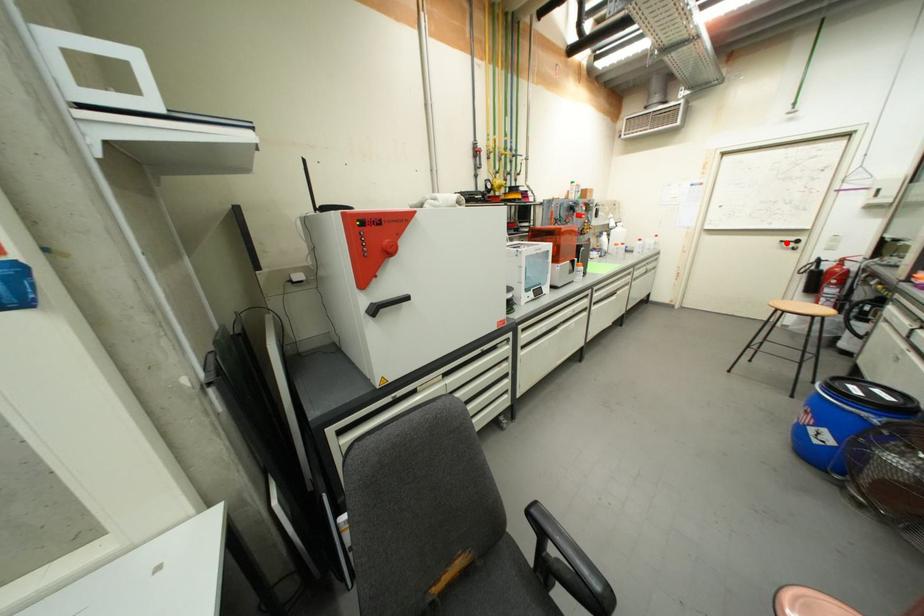
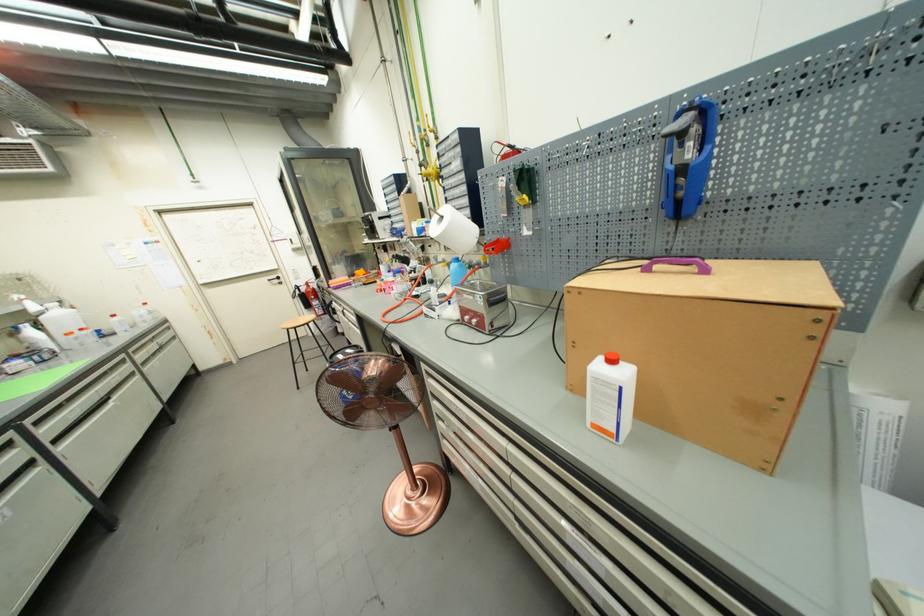
Question: I am providing you with two images of the same scene from different viewpoints. A red point is shown in image1. For the corresponding object point in image2, is it positioned nearer or farther from the camera?

Choices:
 (A) Nearer
 (B) Farther

Answer: (A)